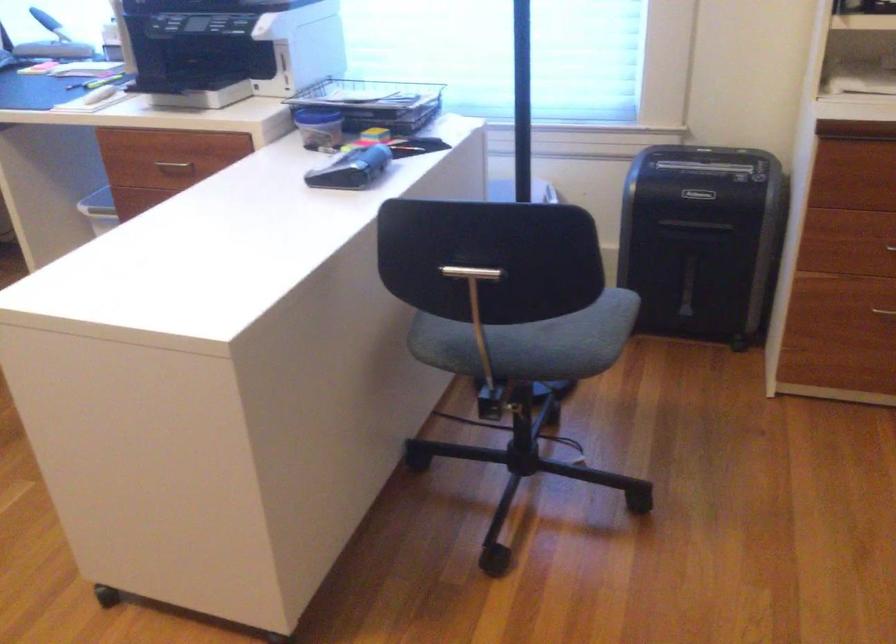
What are the coordinates of `shredder bin handle` in the screenshot? It's located at (693, 225).